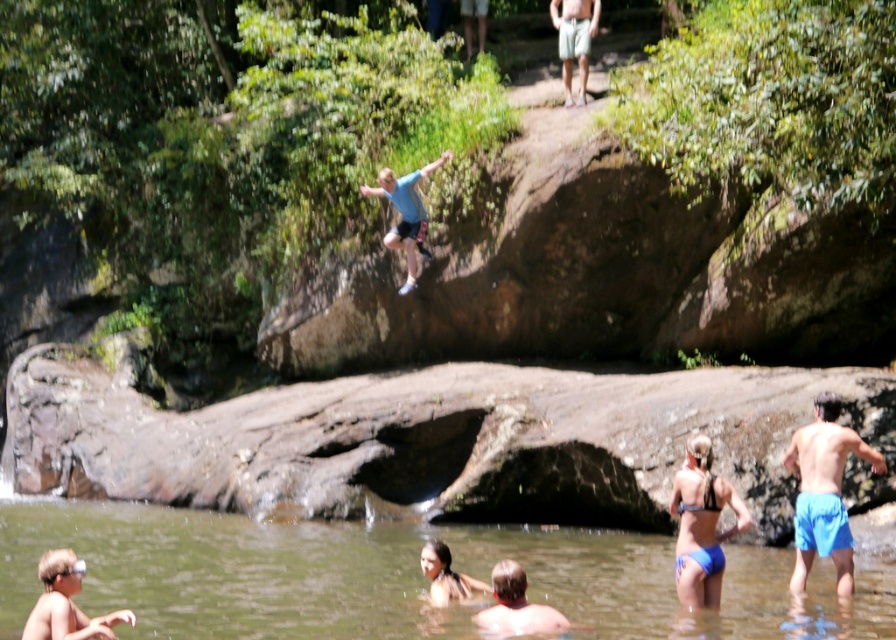
Question: Does blue fabric shorts at lower right have a greater width compared to light blue t-shirt at center?

Choices:
 (A) yes
 (B) no

Answer: (B)

Question: Is blue fabric shorts at lower right further to camera compared to smooth skin boy at lower left?

Choices:
 (A) no
 (B) yes

Answer: (B)

Question: Among these points, which one is farthest from the camera?

Choices:
 (A) (665, 573)
 (B) (424, 168)
 (C) (57, 600)

Answer: (B)

Question: Does light blue t-shirt at center have a greater width compared to green cotton shorts at upper center?

Choices:
 (A) no
 (B) yes

Answer: (B)

Question: Which point is closer to the camera?

Choices:
 (A) blue fabric shorts at lower right
 (B) green cotton shorts at upper center

Answer: (A)

Question: Based on their relative distances, which object is farther from the blue fabric shorts at lower right?

Choices:
 (A) light blue t-shirt at center
 (B) green cotton shorts at upper center
 (C) smooth skin boy at lower left

Answer: (B)